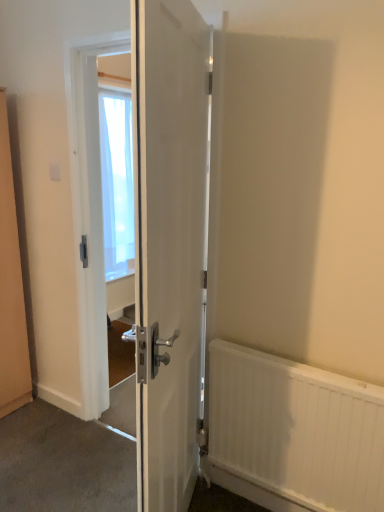
Question: Is transparent fabric at center in front of or behind white textured radiator at lower right in the image?

Choices:
 (A) behind
 (B) front

Answer: (A)

Question: Choose the correct answer: Is transparent fabric at center inside white textured radiator at lower right or outside it?

Choices:
 (A) outside
 (B) inside

Answer: (A)

Question: Which of these objects is positioned farthest from the white textured radiator at lower right?

Choices:
 (A) white glossy door at center
 (B) white plastic electric outlet at upper left
 (C) transparent fabric at center
 (D) white glossy door at center

Answer: (C)

Question: Which object is positioned closest to the white glossy door at center?

Choices:
 (A) white textured radiator at lower right
 (B) white plastic electric outlet at upper left
 (C) white glossy door at center
 (D) transparent fabric at center

Answer: (A)